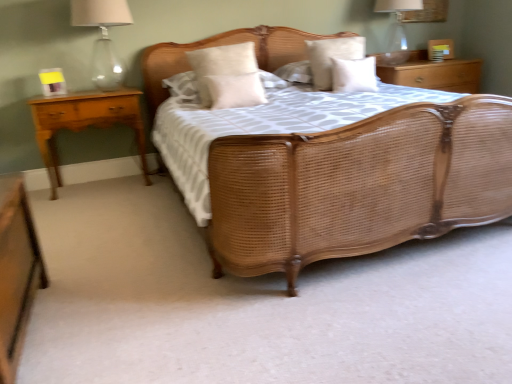
Where is `vacant area that lies between wooden nightstand at lower left, marked as the 1th nightstand in a front-to-back arrangement, and woven wood bed at center`? vacant area that lies between wooden nightstand at lower left, marked as the 1th nightstand in a front-to-back arrangement, and woven wood bed at center is located at coordinates (152, 273).